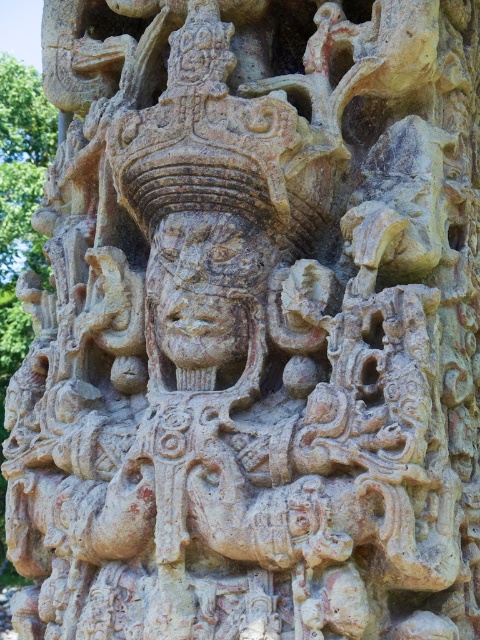
Question: Can you confirm if carved stone face at center is wider than green stone tree at left?

Choices:
 (A) yes
 (B) no

Answer: (A)

Question: Among these objects, which one is nearest to the camera?

Choices:
 (A) carved stone face at center
 (B) green stone tree at left

Answer: (A)

Question: Is carved stone face at center above green stone tree at left?

Choices:
 (A) yes
 (B) no

Answer: (B)

Question: Is carved stone face at center to the left of green stone tree at left from the viewer's perspective?

Choices:
 (A) yes
 (B) no

Answer: (B)